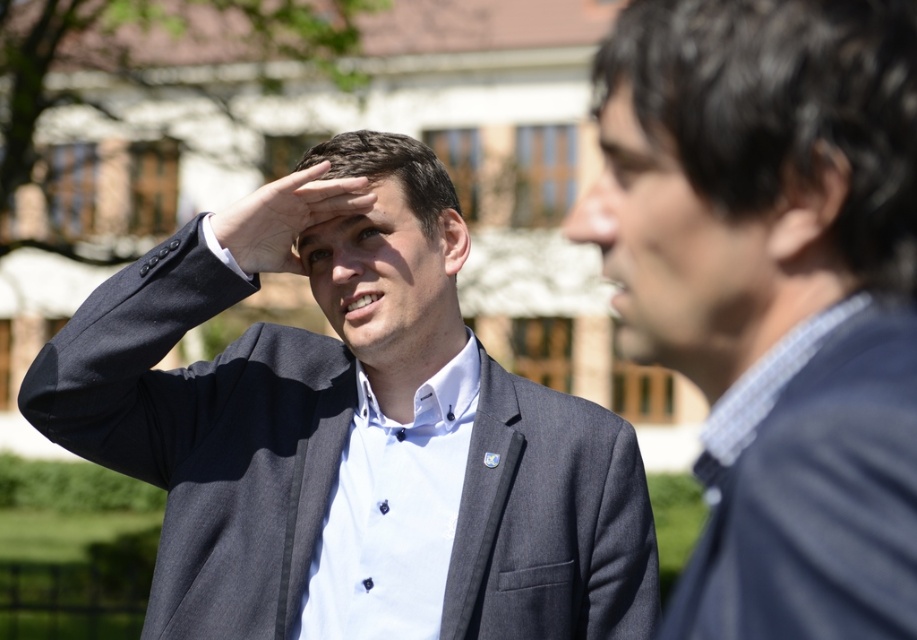
Does matte skin forehead at center have a larger size compared to matte black hair at center?

Actually, matte skin forehead at center might be smaller than matte black hair at center.

Can you confirm if matte skin forehead at center is shorter than matte black hair at center?

Correct, matte skin forehead at center is not as tall as matte black hair at center.

I want to click on matte skin forehead at center, so [x=351, y=211].

Does matte skin ear at center appear on the left side of brown matte eye at upper center?

No, matte skin ear at center is not to the left of brown matte eye at upper center.

Can you confirm if matte skin ear at center is positioned below brown matte eye at upper center?

Yes, matte skin ear at center is below brown matte eye at upper center.

Between point (443, 241) and point (352, 228), which one is positioned in front?

Point (352, 228) is more forward.

Find the location of a particular element. This screenshot has height=640, width=917. matte skin ear at center is located at coordinates click(450, 243).

Which is in front, point (816, 634) or point (319, 244)?

Positioned in front is point (816, 634).

Is blue textured fabric at right closer to camera compared to brown matte eye at center?

Yes, blue textured fabric at right is closer to the viewer.

Which is behind, point (851, 301) or point (315, 250)?

The point (315, 250) is behind.

Find the location of a particular element. The width and height of the screenshot is (917, 640). blue textured fabric at right is located at coordinates (811, 486).